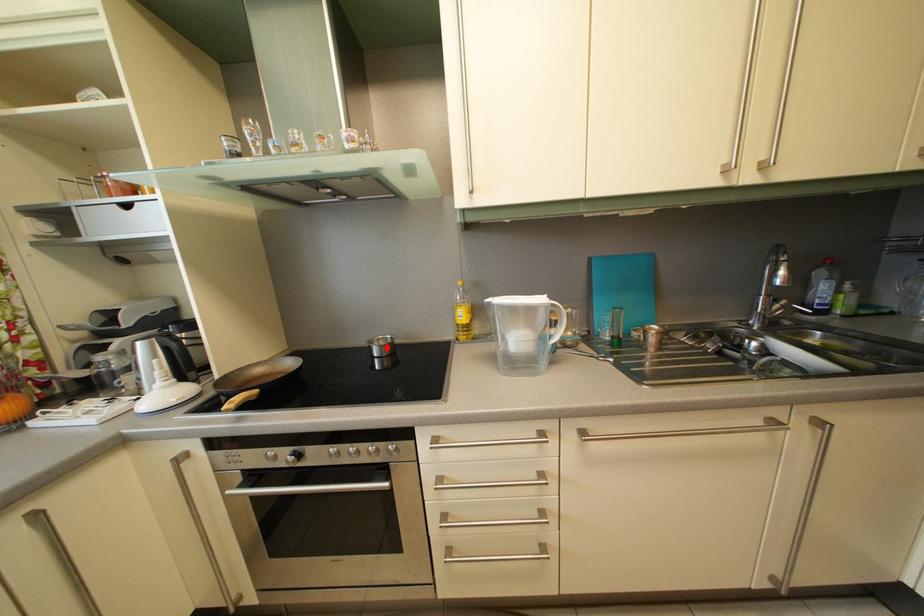
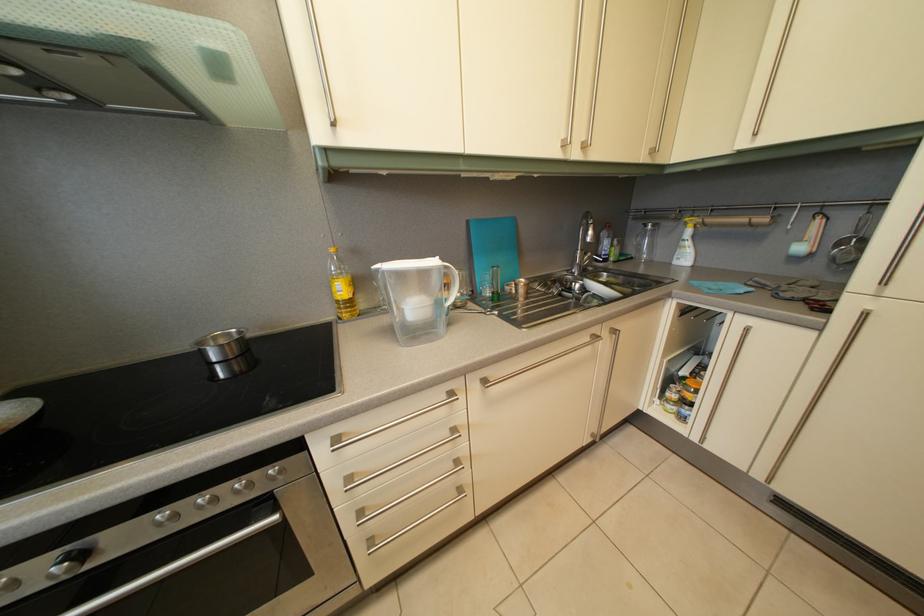
The point at the highlighted location is marked in the first image. Where is the corresponding point in the second image?

(224, 346)